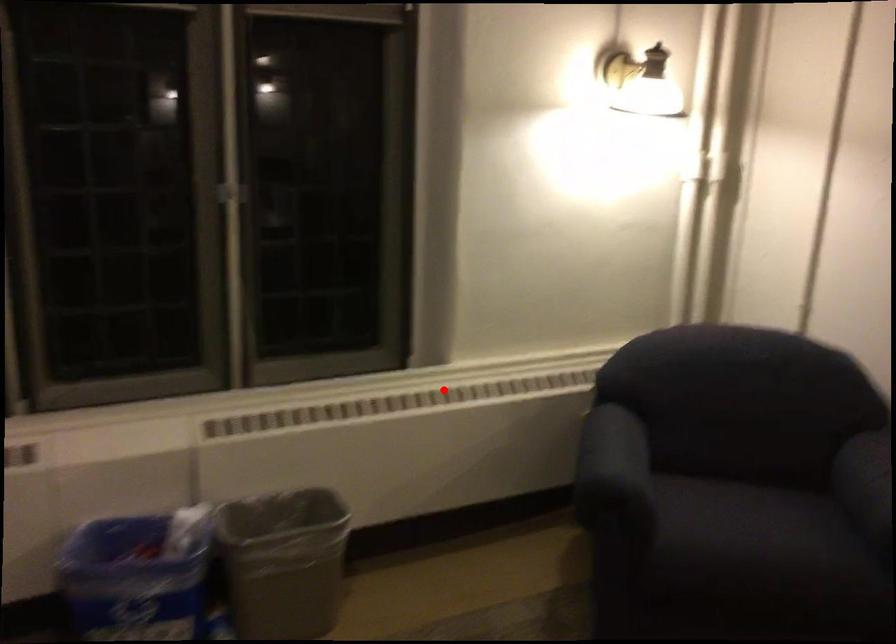
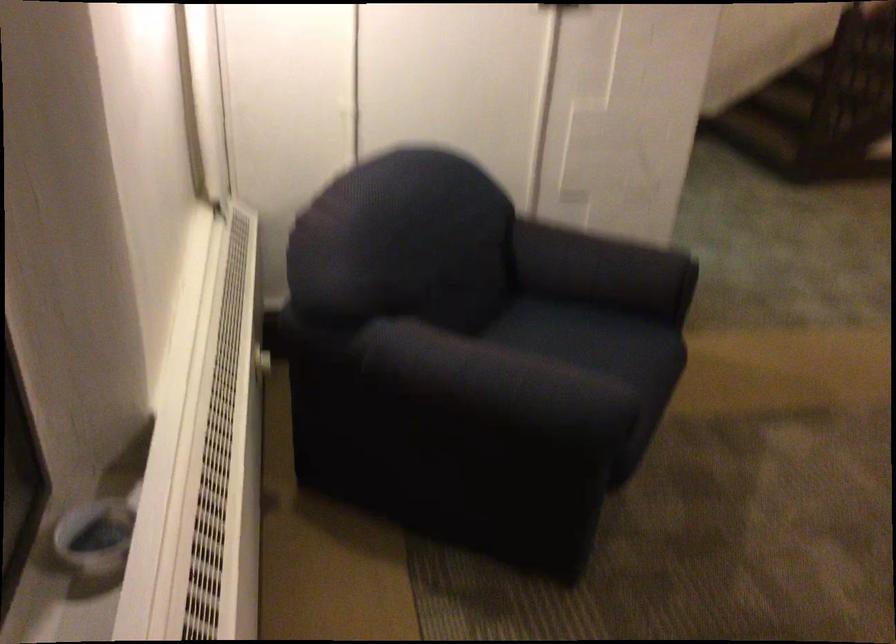
Question: I am providing you with two images of the same scene from different viewpoints. Given a red point in image1, look at the same physical point in image2. Is it:

Choices:
 (A) Closer to the viewpoint
 (B) Farther from the viewpoint

Answer: (A)